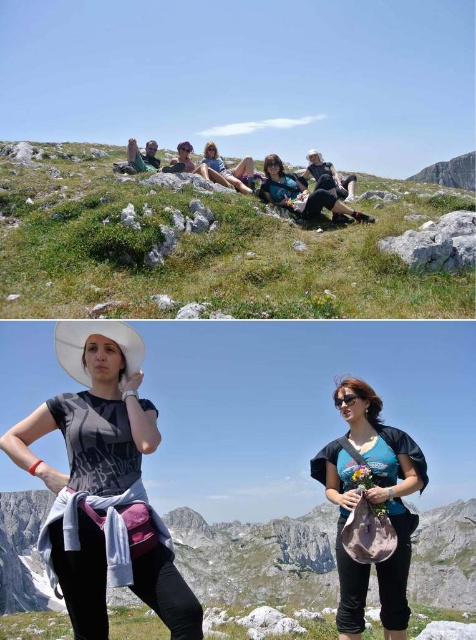
You are planning to set up a tent for a mountain camping trip. You have two possible locations in the image to choose from. The first is the rugged stone mountain at center and the second is the green grassy at lower center. Based on the height differences between these two areas, which location would be more suitable for a campsite and why?

The green grassy at lower center is more suitable for a campsite because it is shorter in height compared to the rugged stone mountain at center. A flatter and lower elevation area like the green grassy at lower center provides a safer and more stable surface for setting up a tent, whereas the rugged stone mountain at center is taller and potentially more unstable due to its rocky terrain.

You are planning to set up a picnic blanket in the lower center area where the green grassy is located. Based on the scene, will the green grassy at lower center provide enough space to comfortably fit the matte black shorts at center on the same blanket?

The green grassy at lower center might be wider than matte black shorts at center, so it could potentially accommodate the shorts, but the exact fit depends on the blanket size and arrangement.